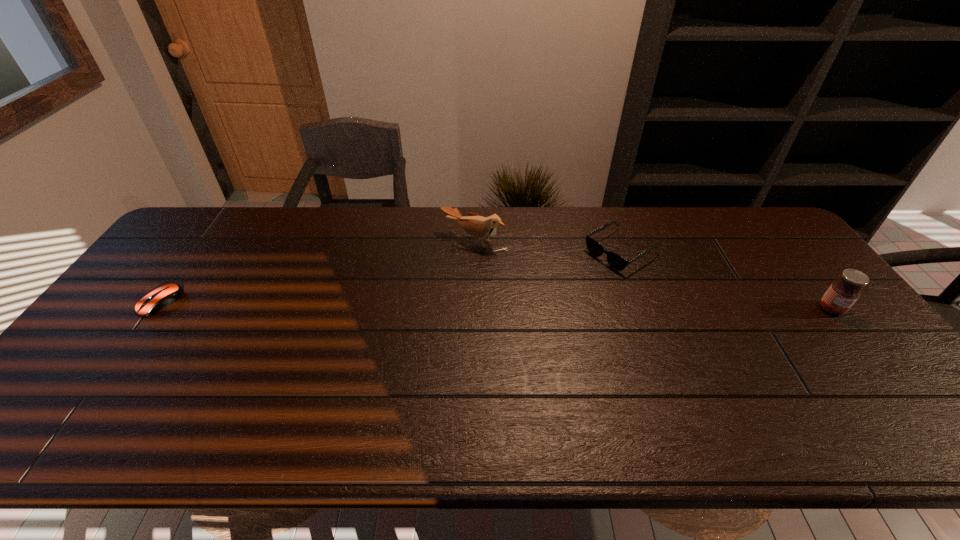
I want to click on the leftmost object, so click(165, 295).

At what (x,y) coordinates should I click in order to perform the action: click on the shortest object. Please return your answer as a coordinate pair (x, y). The width and height of the screenshot is (960, 540). Looking at the image, I should click on (165, 295).

The width and height of the screenshot is (960, 540). Find the location of `jam`. jam is located at coordinates (842, 294).

I want to click on the second object from left to right, so [480, 227].

This screenshot has height=540, width=960. I want to click on sunglasses, so click(616, 261).

Where is `the third tallest object`? The width and height of the screenshot is (960, 540). the third tallest object is located at coordinates (616, 261).

Image resolution: width=960 pixels, height=540 pixels. What are the coordinates of `vacant space located on the right of the computer mouse` in the screenshot? It's located at (278, 303).

Identify the location of vacant space located on the label side of the rightmost object. This screenshot has height=540, width=960. (870, 357).

Locate an element on the screen. The width and height of the screenshot is (960, 540). vacant point located at the beak of the bird is located at coordinates (449, 261).

This screenshot has width=960, height=540. Identify the location of vacant space situated 0.090m at the beak of the bird. (x=443, y=269).